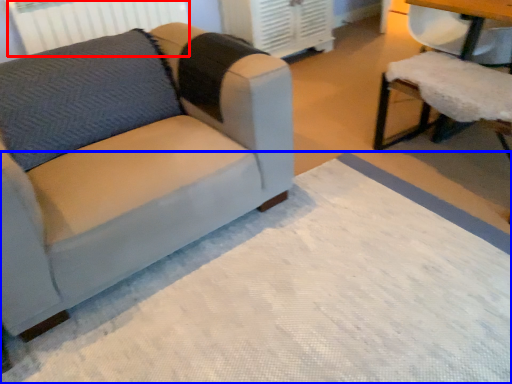
Question: Which object is closer to the camera taking this photo, radiator (highlighted by a red box) or mat (highlighted by a blue box)?

Choices:
 (A) radiator
 (B) mat

Answer: (B)